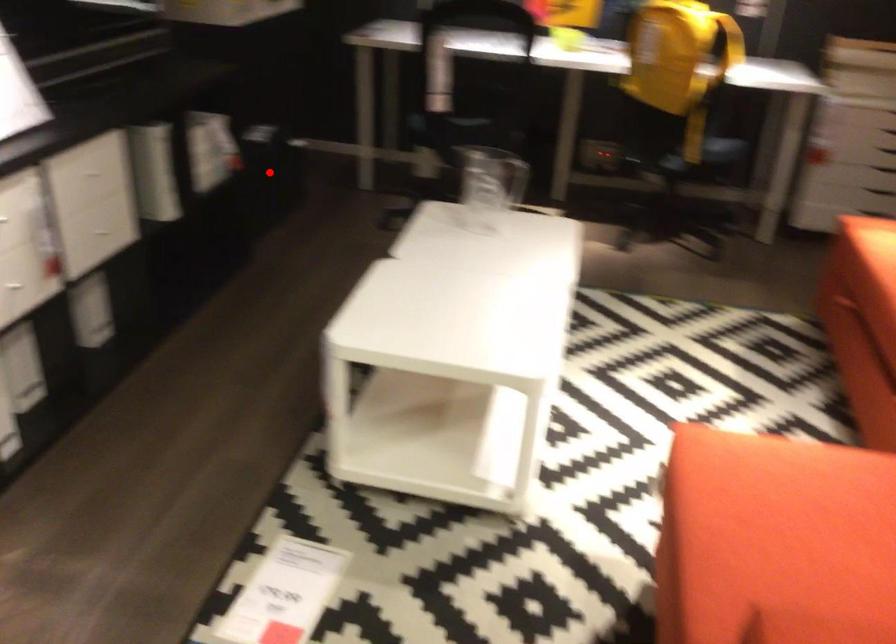
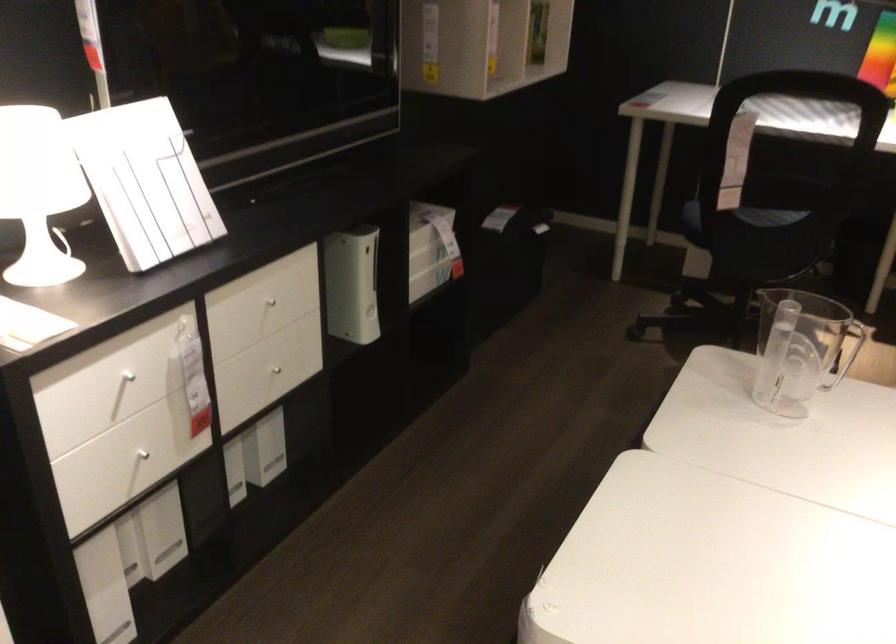
Where in the second image is the point corresponding to the highlighted location from the first image?

(507, 263)